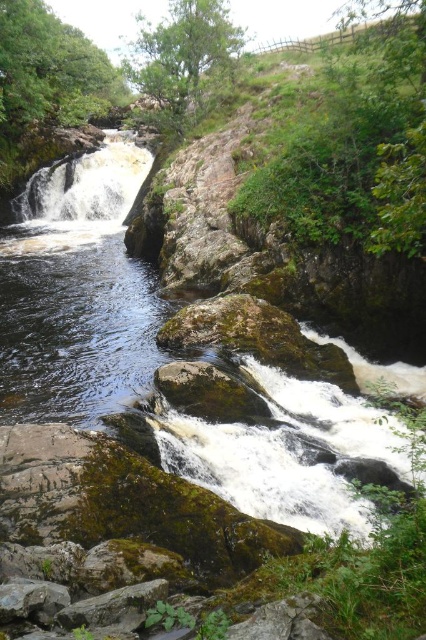
Is white frothy water at center behind green mossy rock at center?

Yes, it is.

Can you confirm if white frothy water at center is positioned to the right of green mossy rock at center?

No, white frothy water at center is not to the right of green mossy rock at center.

Image resolution: width=426 pixels, height=640 pixels. Describe the element at coordinates (88, 182) in the screenshot. I see `white frothy water at center` at that location.

Locate an element on the screen. white frothy water at center is located at coordinates (88, 182).

Can you confirm if brown mossy rock at center is thinner than white frothy water at center?

Incorrect, brown mossy rock at center's width is not less than white frothy water at center's.

Between brown mossy rock at center and white frothy water at center, which one has less height?

Standing shorter between the two is white frothy water at center.

Consider the image. Who is more distant from viewer, (111, 243) or (78, 205)?

Point (78, 205)

Where is `brown mossy rock at center`? This screenshot has height=640, width=426. brown mossy rock at center is located at coordinates (77, 294).

How far apart are brown mossy rock at center and green mossy rock at center?

6.62 feet

Is the position of brown mossy rock at center less distant than that of green mossy rock at center?

Yes, it is in front of green mossy rock at center.

Which is in front, point (408, 474) or point (158, 380)?

Positioned in front is point (408, 474).

Find the location of a particular element. This screenshot has height=640, width=426. brown mossy rock at center is located at coordinates (77, 294).